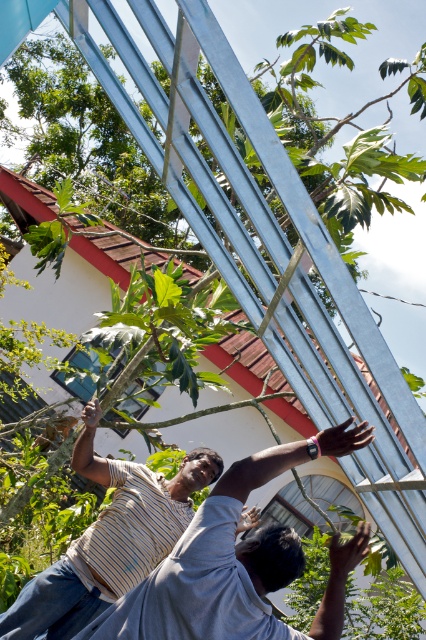
You are a photographer trying to capture a photo of the striped cotton shirt at center and the striped fabric at lower center. Which object should you focus on first if you want to ensure both are in focus without moving the camera?

The striped cotton shirt at center is located above the striped fabric at lower center. To ensure both are in focus, you should focus on the striped fabric at lower center first since it is closer to the camera, allowing the depth of field to cover the shirt above it.

You are standing in the scene and want to hand a tool to the person wearing the striped cotton shirt at center. The tool you have is 2.5 meters long. Can you reach them without moving?

The striped cotton shirt at center is 3.04 meters from viewer. Since the tool is only 2.5 meters long, you cannot reach them without moving closer.